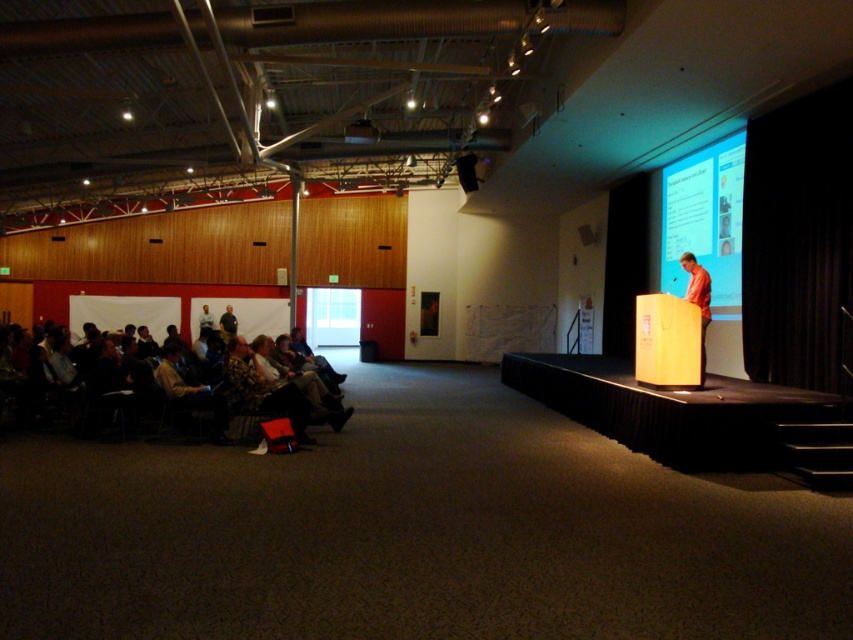
You are standing in the large hall and want to determine which of the two points, point (705, 282) or point (230, 328), is closer to you. Based on the scene description, which point is nearer?

Point (705, 282) is closer to the viewer than point (230, 328).

You are sitting in the audience and want to see both the orange fabric shirt at stage right and the dark gray fabric jacket at lower left. Which one appears larger in your view?

The orange fabric shirt at stage right appears larger because it is closer to the viewer than the dark gray fabric jacket at lower left.

You are an event planner setting up a new projector in the hall. The projector needs to be placed at point A, which is at coordinates 0.5, 0.5. Can you determine if the matte white screen at upper right is positioned in a way that the projector can project onto it without obstruction?

The matte white screen at upper right is located at point (705, 220), which is to the left and above the projector at (426, 320). Since the screen is positioned in the upper right area and the projector is centrally placed, there might be a clear line of sight. However, without knowing the exact path or any potential obstructions between them, it is uncertain. The description does not mention any obstacles, so assuming no obstructions, the projector can likely project onto the screen.